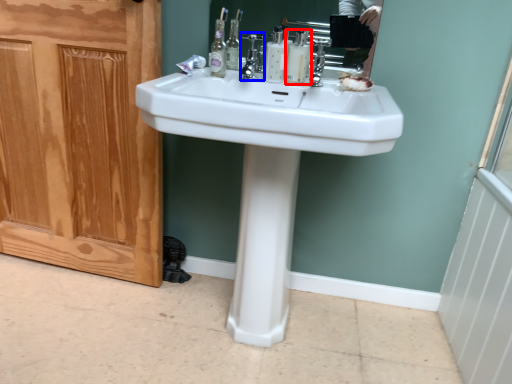
Question: Which object appears farthest to the camera in this image, mouthwash (highlighted by a red box) or faucet (highlighted by a blue box)?

Choices:
 (A) mouthwash
 (B) faucet

Answer: (A)